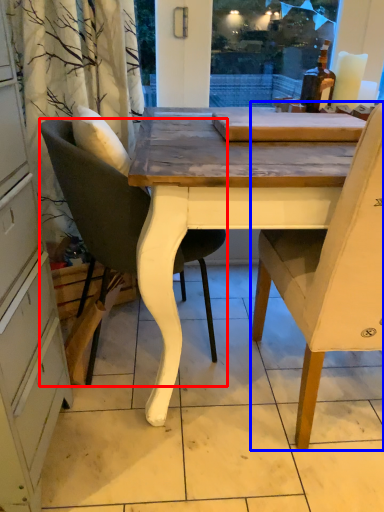
Question: Among these objects, which one is nearest to the camera, chair (highlighted by a red box) or chair (highlighted by a blue box)?

Choices:
 (A) chair
 (B) chair

Answer: (B)